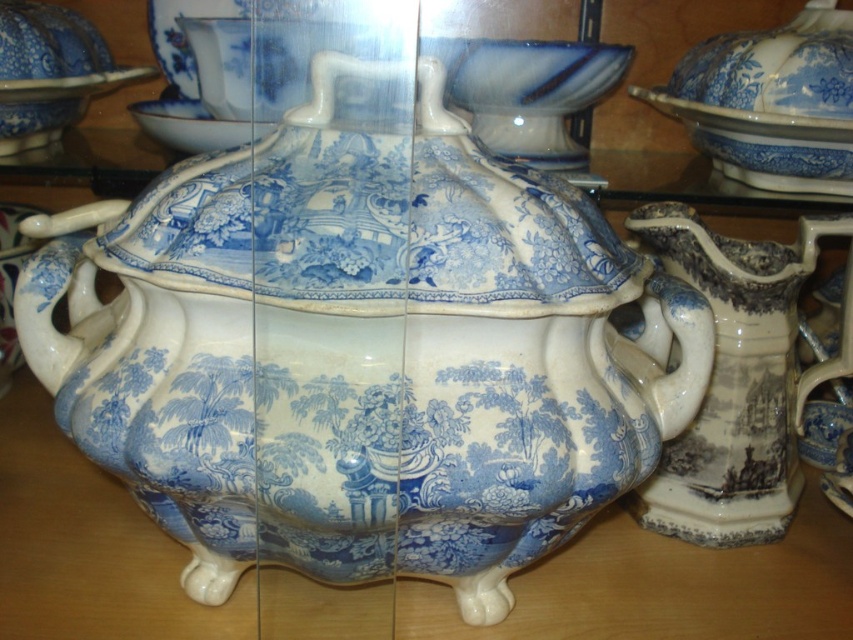
You are a museum curator arranging an exhibition. You need to place a 12 inch wide decorative plate between the blue glazed teapot at center and the blue and white ceramic pitcher at right. Is there enough space between them to fit the plate?

The distance between the blue glazed teapot at center and the blue and white ceramic pitcher at right is 10.32 inches. Since the plate is 12 inches wide, it cannot fit in the space between them.

You are a museum curator arranging an exhibition. You have a blue and white ceramic pitcher at right and a blue glazed plate at upper left. Which object should you place in a larger display space to accommodate its size?

The blue and white ceramic pitcher at right is larger in size than the blue glazed plate at upper left, so you should place the blue and white ceramic pitcher at right in a larger display space to accommodate its size.

You are standing in front of a display case with the blue and white ceramic items. There is a point at coordinates (486, 195) that you need to reach with your finger. Can you estimate how far your finger needs to extend to touch that specific point?

The point at (486, 195) is 23.34 inches away from the viewer, so your finger needs to extend approximately 23.34 inches to touch it.